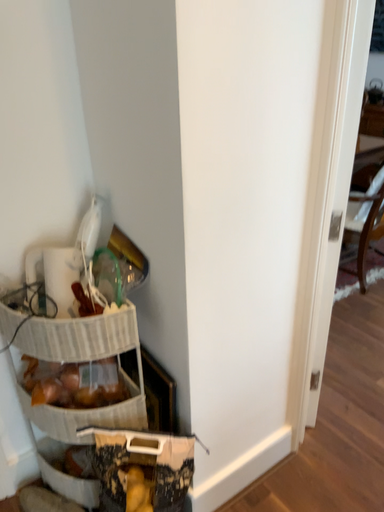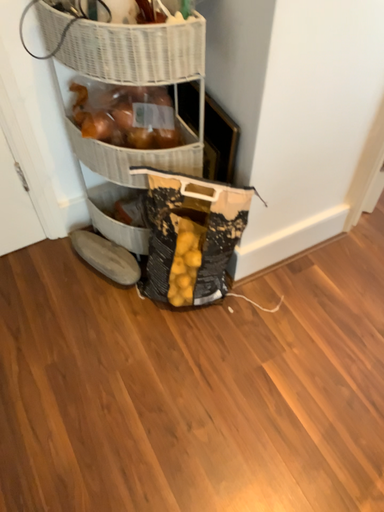
Question: How did the camera likely rotate when shooting the video?

Choices:
 (A) rotated downward
 (B) rotated upward

Answer: (A)